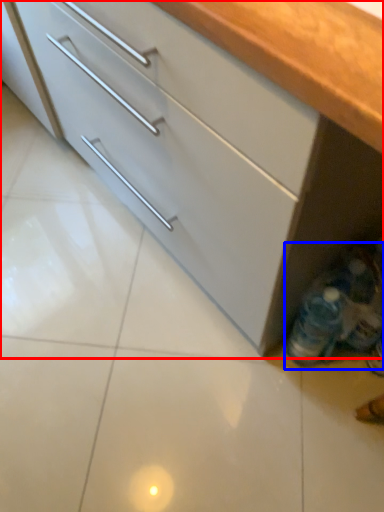
Question: Which object appears closest to the camera in this image, cabinetry (highlighted by a red box) or bottle (highlighted by a blue box)?

Choices:
 (A) cabinetry
 (B) bottle

Answer: (A)